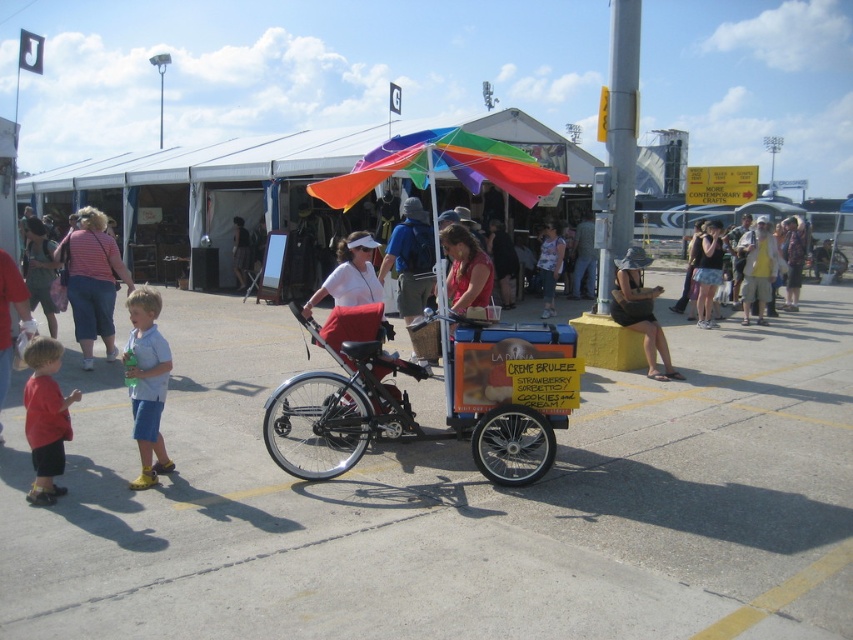
Question: Where is rainbow fabric umbrella at center located in relation to black fabric hat at center in the image?

Choices:
 (A) below
 (B) above

Answer: (B)

Question: Is matte red shorts at lower left below denim shorts at center?

Choices:
 (A) no
 (B) yes

Answer: (B)

Question: Does metallic silver cart at center lie in front of denim shorts at center?

Choices:
 (A) no
 (B) yes

Answer: (B)

Question: Which point is farther from the camera taking this photo?

Choices:
 (A) (468, 182)
 (B) (422, 244)

Answer: (B)

Question: Which of the following is the farthest from the observer?

Choices:
 (A) (132, 330)
 (B) (416, 237)
 (C) (453, 148)
 (D) (549, 282)

Answer: (D)

Question: Which object appears closest to the camera in this image?

Choices:
 (A) rainbow fabric umbrella at center
 (B) light blue denim shorts at lower left
 (C) black fabric hat at center
 (D) denim shorts at center

Answer: (B)